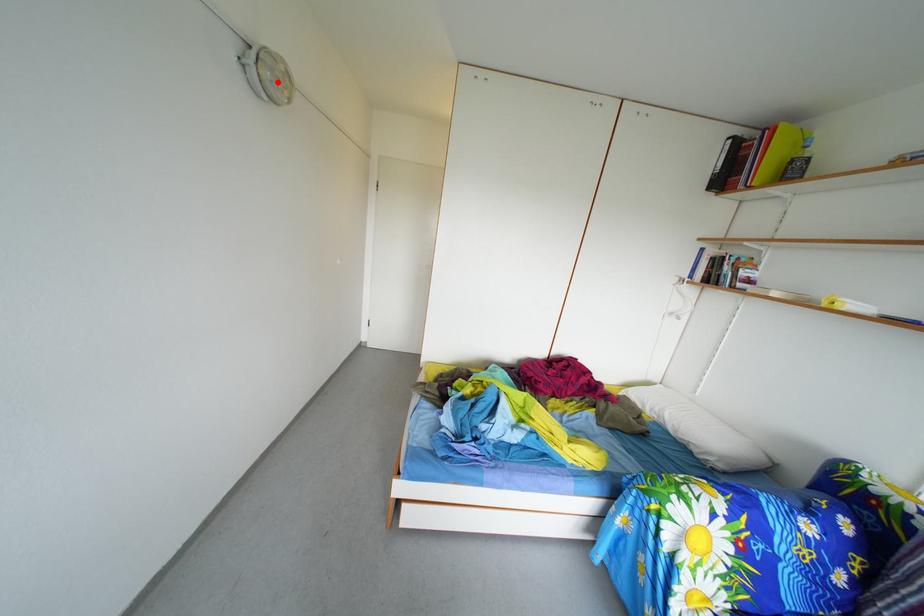
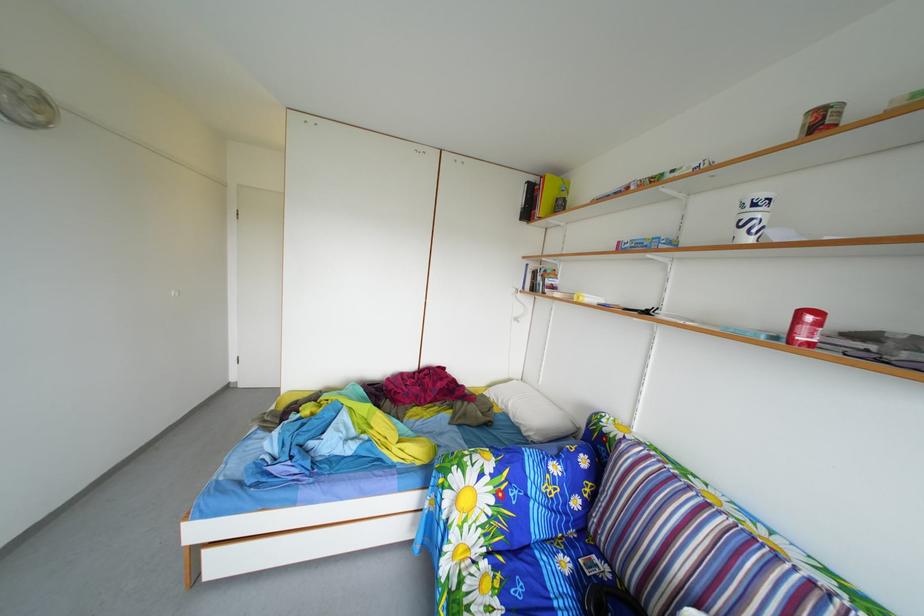
The point at the highlighted location is marked in the first image. Where is the corresponding point in the second image?

(14, 105)